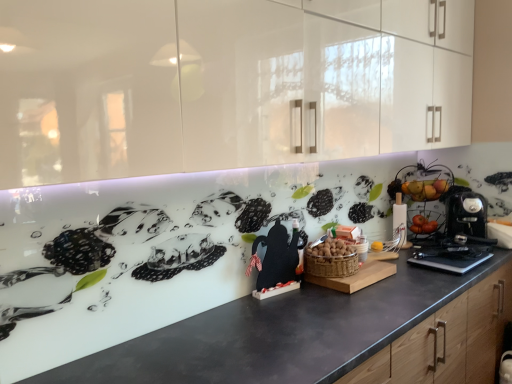
Image resolution: width=512 pixels, height=384 pixels. Identify the location of black plastic coffee machine at right. pos(467,217).

This screenshot has width=512, height=384. Describe the element at coordinates (467, 217) in the screenshot. I see `black plastic coffee machine at right` at that location.

Where is `black plastic coffee machine at right`? This screenshot has width=512, height=384. black plastic coffee machine at right is located at coordinates (467, 217).